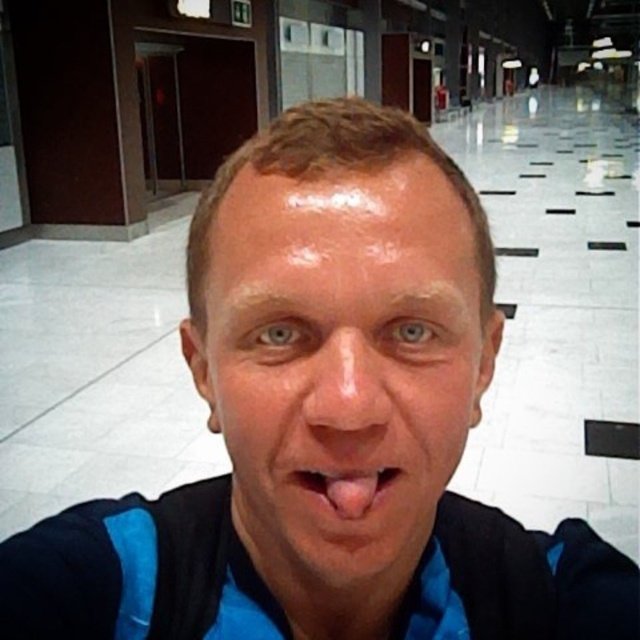
Question: Which point is farther from the camera taking this photo?

Choices:
 (A) (308, 502)
 (B) (323, 390)
 (C) (273, 513)

Answer: (C)

Question: Is the position of smooth skin face at center less distant than that of pink flesh at center?

Choices:
 (A) yes
 (B) no

Answer: (A)

Question: Can you confirm if smooth skin nose at center is positioned to the right of pink flesh at center?

Choices:
 (A) no
 (B) yes

Answer: (A)

Question: Which of the following is the farthest from the observer?

Choices:
 (A) smooth skin nose at center
 (B) smooth skin face at center
 (C) pink flesh at center

Answer: (C)

Question: Is smooth skin face at center to the right of pink flesh at center from the viewer's perspective?

Choices:
 (A) no
 (B) yes

Answer: (A)

Question: Among these points, which one is nearest to the camera?

Choices:
 (A) (316, 352)
 (B) (230, 390)

Answer: (A)